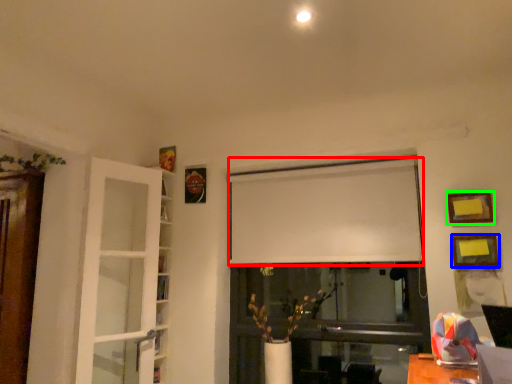
Question: Which object is positioned farthest from curtain (highlighted by a red box)? Select from picture frame (highlighted by a blue box) and picture frame (highlighted by a green box).

Choices:
 (A) picture frame
 (B) picture frame

Answer: (A)